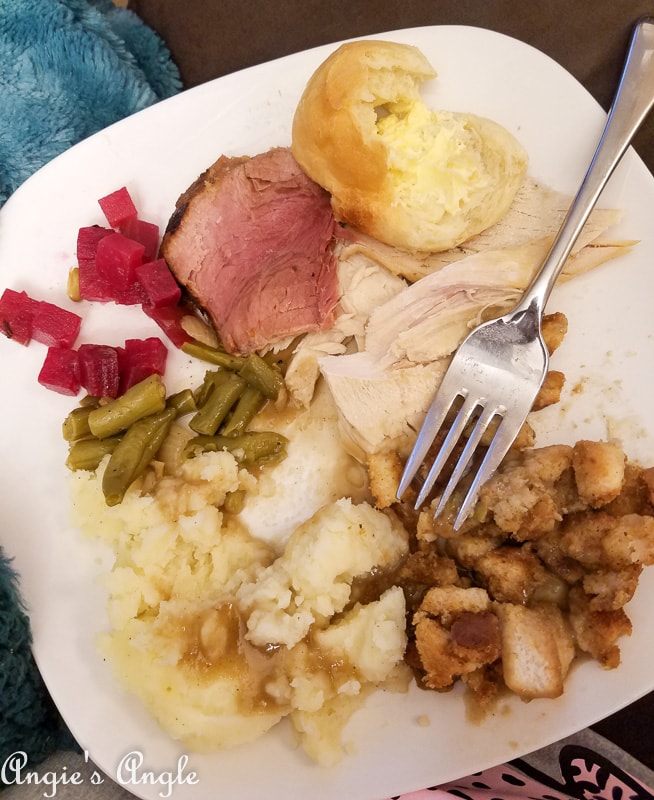
Find the location of `silver fork`. silver fork is located at coordinates (513, 358).